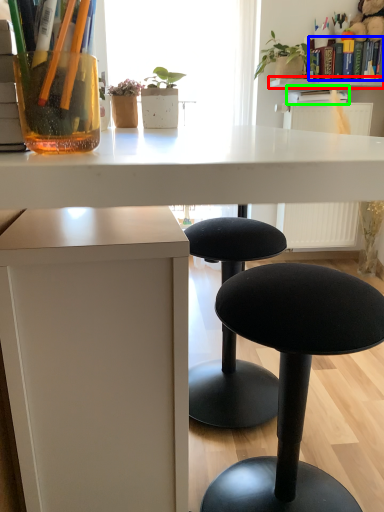
Question: Which object is the farthest from window sill (highlighted by a red box)? Choose among these: book (highlighted by a blue box) or book (highlighted by a green box).

Choices:
 (A) book
 (B) book

Answer: (A)